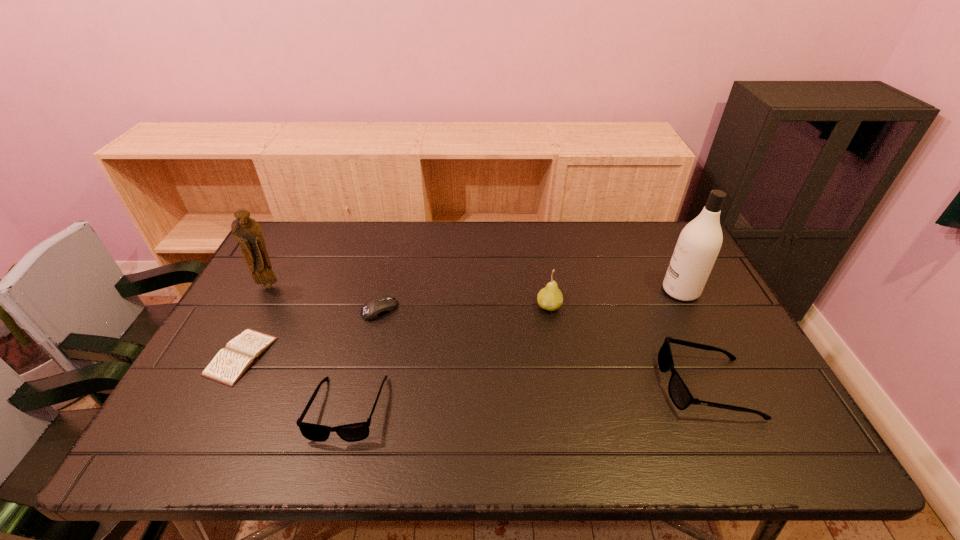
In the image, there is a desktop. Identify the location of vacant space at the right edge. The image size is (960, 540). pos(704,303).

Locate an element on the screen. free space at the near left corner of the desktop is located at coordinates (240, 405).

This screenshot has width=960, height=540. What are the coordinates of `free region at the far right corner of the desktop` in the screenshot? It's located at (660, 259).

Locate an element on the screen. The height and width of the screenshot is (540, 960). vacant space at the near right corner of the desktop is located at coordinates (746, 386).

Where is `free space between the figurine and the fourth tallest object`? This screenshot has width=960, height=540. free space between the figurine and the fourth tallest object is located at coordinates (488, 336).

Locate an element on the screen. The image size is (960, 540). free space between the right sunglasses and the second shortest object is located at coordinates (543, 348).

This screenshot has height=540, width=960. Identify the location of free space between the fourth tallest object and the left sunglasses. (527, 397).

Identify the location of vacant area between the right sunglasses and the shortest object. point(473,371).

At what (x,y) coordinates should I click in order to perform the action: click on free space between the computer equipment and the tallest object. Please return your answer as a coordinate pair (x, y). This screenshot has width=960, height=540. Looking at the image, I should click on (530, 300).

The image size is (960, 540). I want to click on unoccupied area between the figurine and the left sunglasses, so click(308, 347).